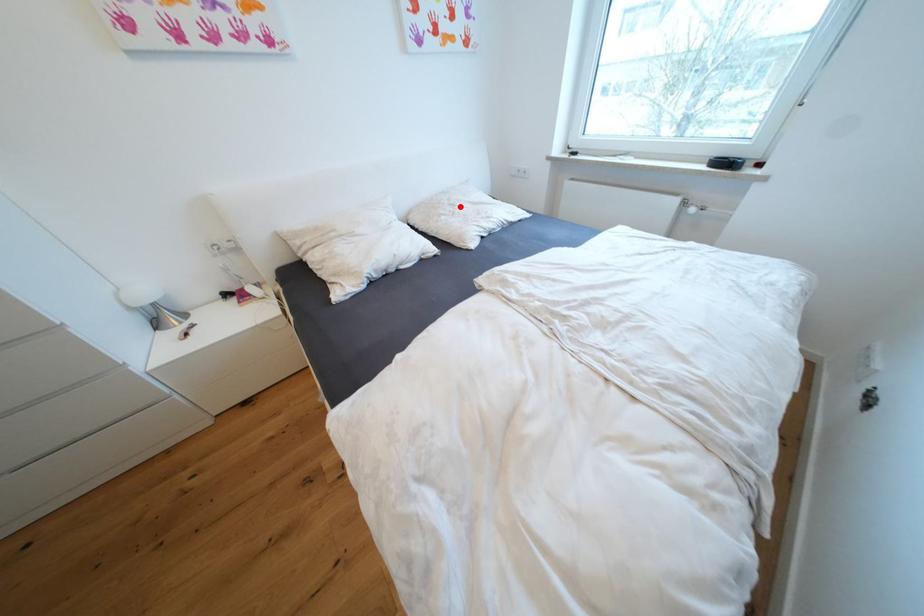
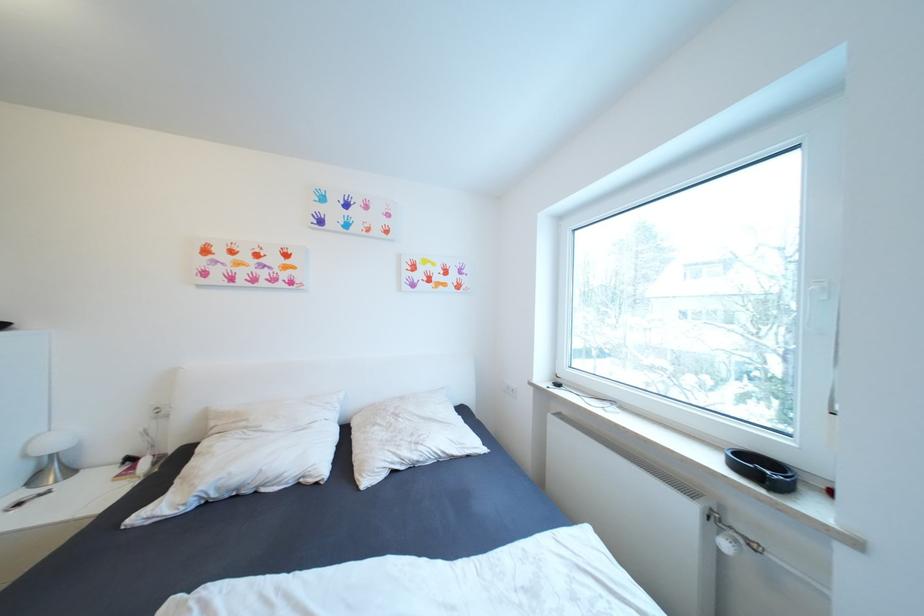
The point at the highlighted location is marked in the first image. Where is the corresponding point in the second image?

(405, 416)